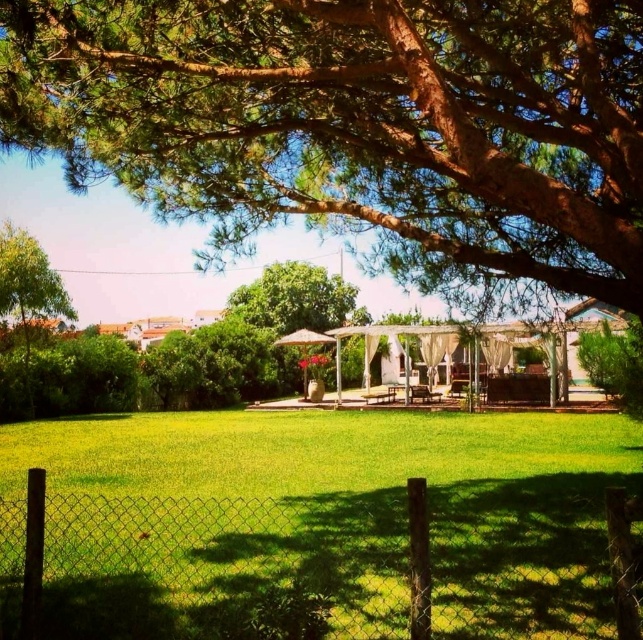
Who is shorter, green leafy tree at upper center or wire mesh fence at lower center?

Standing shorter between the two is green leafy tree at upper center.

Which is more to the left, green leafy tree at upper center or wire mesh fence at lower center?

Positioned to the left is wire mesh fence at lower center.

Who is more distant from viewer, (x=14, y=118) or (x=354, y=634)?

Positioned behind is point (x=14, y=118).

The height and width of the screenshot is (640, 643). In order to click on green leafy tree at upper center in this screenshot , I will do `click(356, 124)`.

Which is above, wire mesh fence at lower center or green leafy tree at left?

green leafy tree at left is higher up.

Can you confirm if wire mesh fence at lower center is smaller than green leafy tree at left?

Yes.

Locate an element on the screen. This screenshot has width=643, height=640. wire mesh fence at lower center is located at coordinates (327, 564).

Find the location of `wire mesh fence at lower center`. wire mesh fence at lower center is located at coordinates (327, 564).

Who is taller, green leafy tree at upper center or green leafy tree at left?

green leafy tree at left is taller.

Is point (107, 141) more distant than point (10, 291)?

No, (107, 141) is closer to viewer.

Identify the location of green leafy tree at upper center. (356, 124).